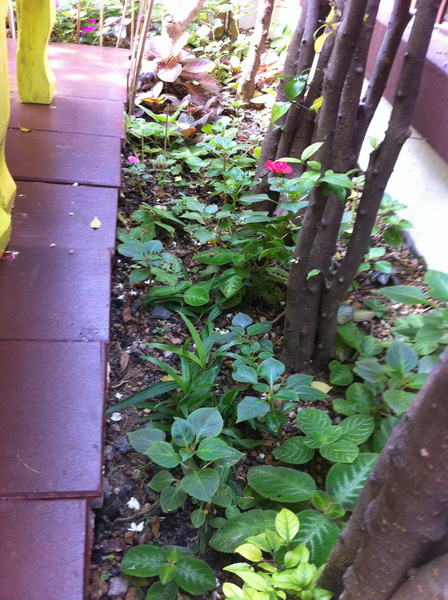
Identify the location of wall. The width and height of the screenshot is (448, 600). (438, 200), (372, 136), (364, 85), (313, 67), (291, 11), (247, 18).